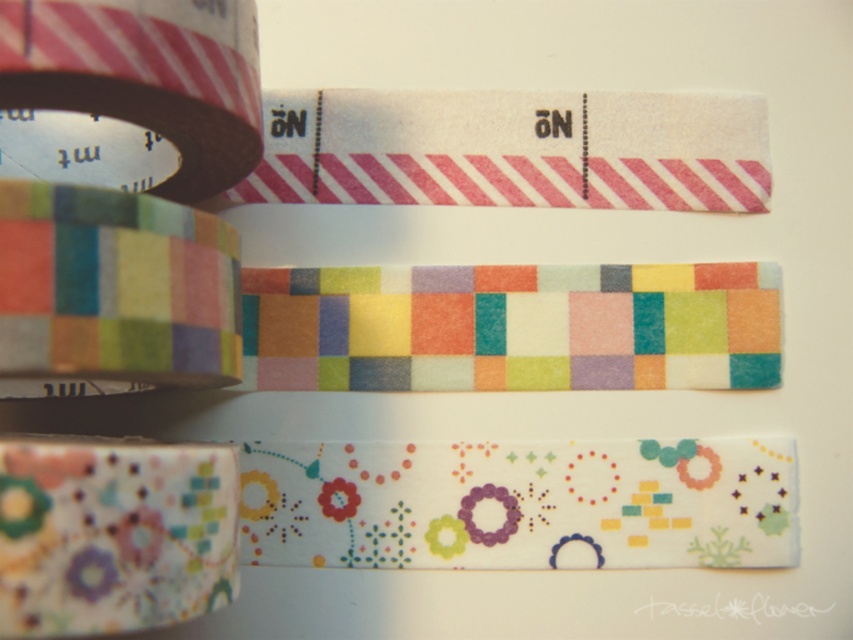
Question: Based on their relative distances, which object is farther from the matte black tape at left?

Choices:
 (A) multicolored fabric measuring tape at upper left
 (B) floral-patterned paper tape at lower left

Answer: (B)

Question: Which object appears farthest from the camera in this image?

Choices:
 (A) matte black tape at left
 (B) floral-patterned paper tape at lower left

Answer: (A)

Question: Is floral-patterned paper tape at lower left below multicolored fabric measuring tape at upper left?

Choices:
 (A) no
 (B) yes

Answer: (B)

Question: Among these points, which one is nearest to the camera?

Choices:
 (A) (33, 524)
 (B) (73, 225)

Answer: (A)

Question: Does floral-patterned paper tape at lower left have a smaller size compared to multicolored fabric measuring tape at upper left?

Choices:
 (A) yes
 (B) no

Answer: (A)

Question: Does floral-patterned paper tape at lower left have a lesser width compared to multicolored fabric measuring tape at upper left?

Choices:
 (A) yes
 (B) no

Answer: (A)